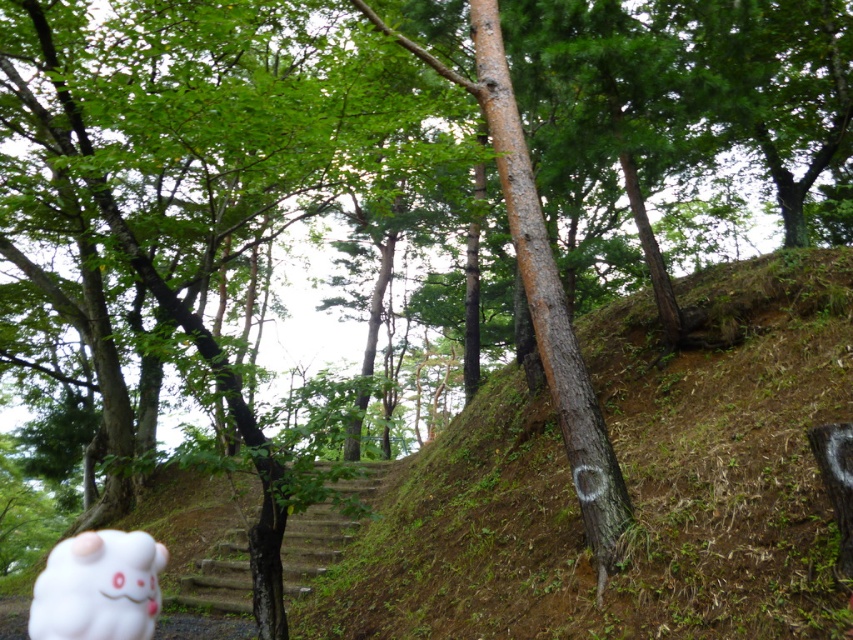
Question: Which point is closer to the camera taking this photo?

Choices:
 (A) (332, 520)
 (B) (328, 572)
 (C) (93, 564)

Answer: (C)

Question: Which object is the closest to the brown dirt hillside at center?

Choices:
 (A) smooth concrete stairs at center
 (B) white fluffy plushie at lower left

Answer: (A)

Question: Does white fluffy plushie at lower left lie in front of smooth concrete stairs at center?

Choices:
 (A) no
 (B) yes

Answer: (B)

Question: Is brown dirt hillside at center further to the viewer compared to smooth concrete stairs at center?

Choices:
 (A) yes
 (B) no

Answer: (B)

Question: Does brown dirt hillside at center appear on the left side of white fluffy plushie at lower left?

Choices:
 (A) no
 (B) yes

Answer: (A)

Question: Which is nearer to the white fluffy plushie at lower left?

Choices:
 (A) smooth concrete stairs at center
 (B) brown dirt hillside at center

Answer: (B)